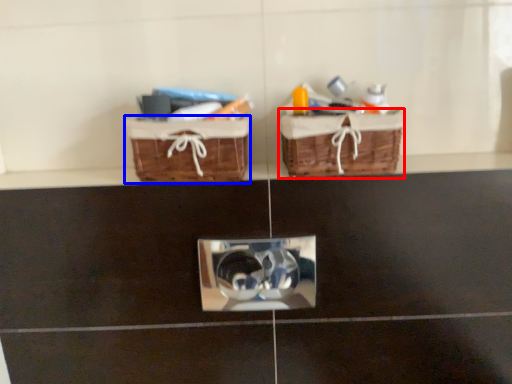
Question: Which of the following is the closest to the observer, picnic basket (highlighted by a red box) or picnic basket (highlighted by a blue box)?

Choices:
 (A) picnic basket
 (B) picnic basket

Answer: (A)